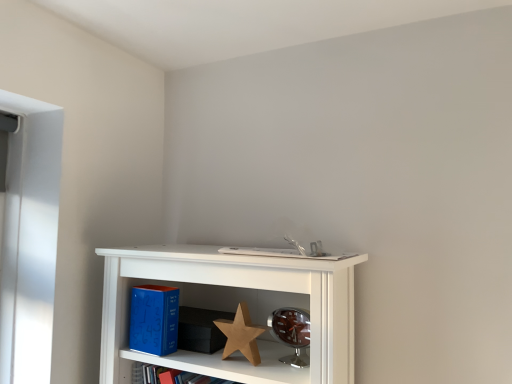
Question: Can you confirm if wooden star at center is positioned to the left of white matte book at center?

Choices:
 (A) no
 (B) yes

Answer: (B)

Question: Is white matte book at center surrounded by wooden star at center?

Choices:
 (A) no
 (B) yes

Answer: (A)

Question: Is wooden star at center facing away from white matte book at center?

Choices:
 (A) yes
 (B) no

Answer: (B)

Question: Considering the relative sizes of wooden star at center and white matte book at center in the image provided, is wooden star at center bigger than white matte book at center?

Choices:
 (A) no
 (B) yes

Answer: (A)

Question: From the image's perspective, is wooden star at center above white matte book at center?

Choices:
 (A) yes
 (B) no

Answer: (B)

Question: Looking at their shapes, would you say wooden star at center is wider or thinner than blue matte book at lower left?

Choices:
 (A) wide
 (B) thin

Answer: (B)

Question: Is wooden star at center bigger or smaller than blue matte book at lower left?

Choices:
 (A) big
 (B) small

Answer: (B)

Question: Considering the positions of point (243, 342) and point (164, 322), is point (243, 342) closer or farther from the camera than point (164, 322)?

Choices:
 (A) closer
 (B) farther

Answer: (A)

Question: From the image's perspective, relative to blue matte book at lower left, is wooden star at center above or below?

Choices:
 (A) above
 (B) below

Answer: (B)

Question: Looking at the image, does white matte book at center seem bigger or smaller compared to blue matte book at lower left?

Choices:
 (A) small
 (B) big

Answer: (B)

Question: Is white matte book at center spatially inside blue matte book at lower left, or outside of it?

Choices:
 (A) inside
 (B) outside

Answer: (B)

Question: Considering their positions, is white matte book at center located in front of or behind blue matte book at lower left?

Choices:
 (A) front
 (B) behind

Answer: (A)

Question: Is white matte book at center to the left or to the right of blue matte book at lower left in the image?

Choices:
 (A) left
 (B) right

Answer: (B)

Question: From a real-world perspective, is white matte book at center positioned above or below wooden star at center?

Choices:
 (A) below
 (B) above

Answer: (B)

Question: Does point (230, 251) appear closer or farther from the camera than point (240, 309)?

Choices:
 (A) closer
 (B) farther

Answer: (B)